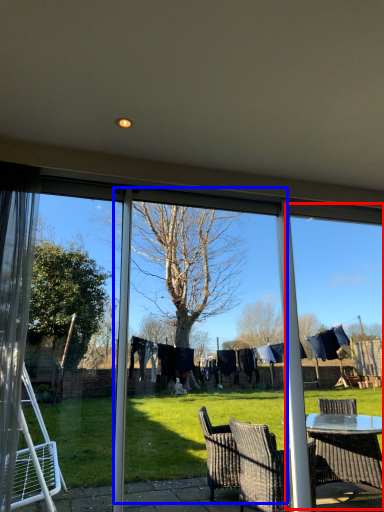
Question: Which point is further to the camera, window frame (highlighted by a red box) or screen door (highlighted by a blue box)?

Choices:
 (A) window frame
 (B) screen door

Answer: (A)